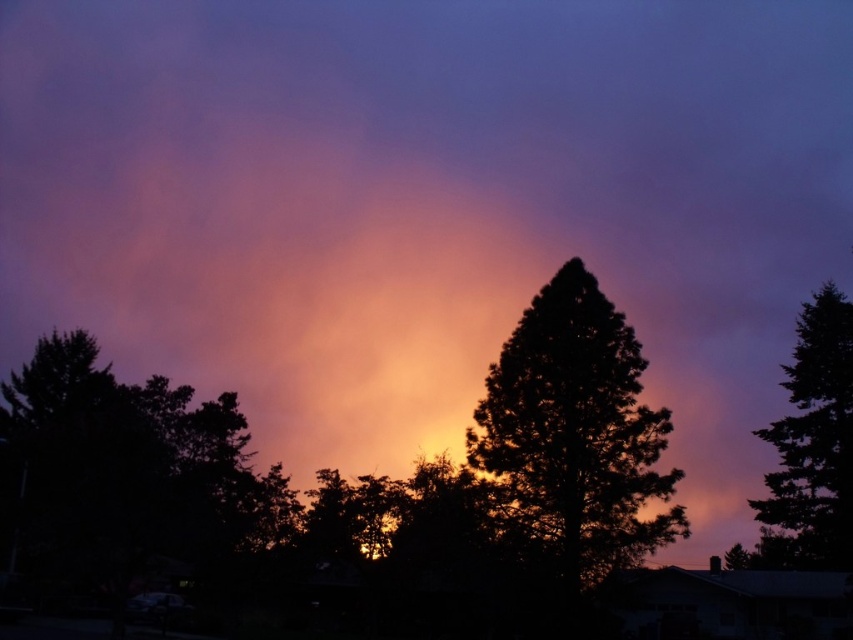
Who is positioned more to the right, dark green leafy tree at left or dark green textured tree at right?

From the viewer's perspective, dark green textured tree at right appears more on the right side.

Identify the location of dark green leafy tree at left. This screenshot has height=640, width=853. (131, 474).

Where is `dark green leafy tree at left`? dark green leafy tree at left is located at coordinates (131, 474).

Between dark green leafy tree at left and dark green textured tree at center, which one has more height?

dark green textured tree at center

Is dark green leafy tree at left positioned in front of dark green textured tree at center?

Yes.

Find the location of a particular element. This screenshot has width=853, height=640. dark green leafy tree at left is located at coordinates (131, 474).

Find the location of a particular element. The image size is (853, 640). dark green leafy tree at left is located at coordinates click(131, 474).

Is point (529, 444) more distant than point (766, 506)?

That is False.

Can you confirm if dark green textured tree at center is shorter than dark green textured tree at right?

Indeed, dark green textured tree at center has a lesser height compared to dark green textured tree at right.

Does point (635, 468) come closer to viewer compared to point (834, 374)?

Yes, point (635, 468) is closer to viewer.

You are a GUI agent. You are given a task and a screenshot of the screen. Output one action in this format:
    pyautogui.click(x=<x>, y=<y>)
    Task: Click on the dark green textured tree at center
    The width and height of the screenshot is (853, 640).
    Given the screenshot: What is the action you would take?
    pyautogui.click(x=573, y=435)